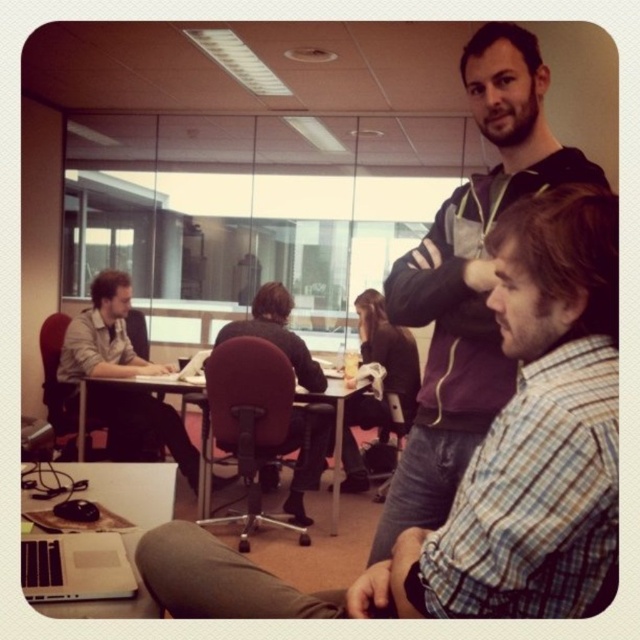
Question: Which of the following is the closest to the observer?

Choices:
 (A) plaid cotton shirt at center
 (B) matte black shirt at left

Answer: (A)

Question: Which of the following is the farthest from the observer?

Choices:
 (A) matte black shirt at left
 (B) velvet-like maroon swivel chair at center
 (C) plaid cotton shirt at center

Answer: (A)

Question: Does velvet-like maroon swivel chair at center appear on the right side of silver metallic laptop at lower left?

Choices:
 (A) no
 (B) yes

Answer: (A)

Question: Is plaid cotton shirt at center thinner than matte black shirt at left?

Choices:
 (A) no
 (B) yes

Answer: (B)

Question: Where is plaid shirt at center located in relation to matte black shirt at left in the image?

Choices:
 (A) above
 (B) below

Answer: (A)

Question: Estimate the real-world distances between objects in this image. Which object is closer to the matte black shirt at left?

Choices:
 (A) plaid shirt at center
 (B) plaid cotton shirt at center
 (C) velvet-like maroon swivel chair at center

Answer: (C)